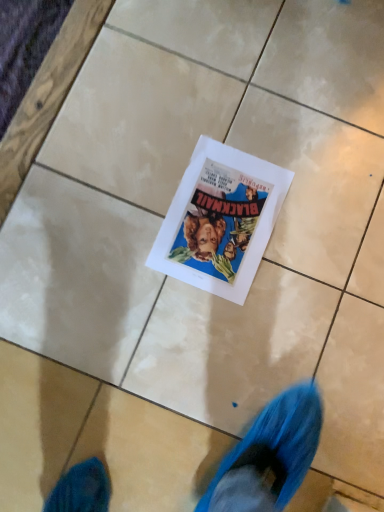
At what (x,y) coordinates should I click in order to perform the action: click on space that is in front of matte paper poster at center. Please return your answer as a coordinate pair (x, y). This screenshot has width=384, height=512. Looking at the image, I should click on (189, 333).